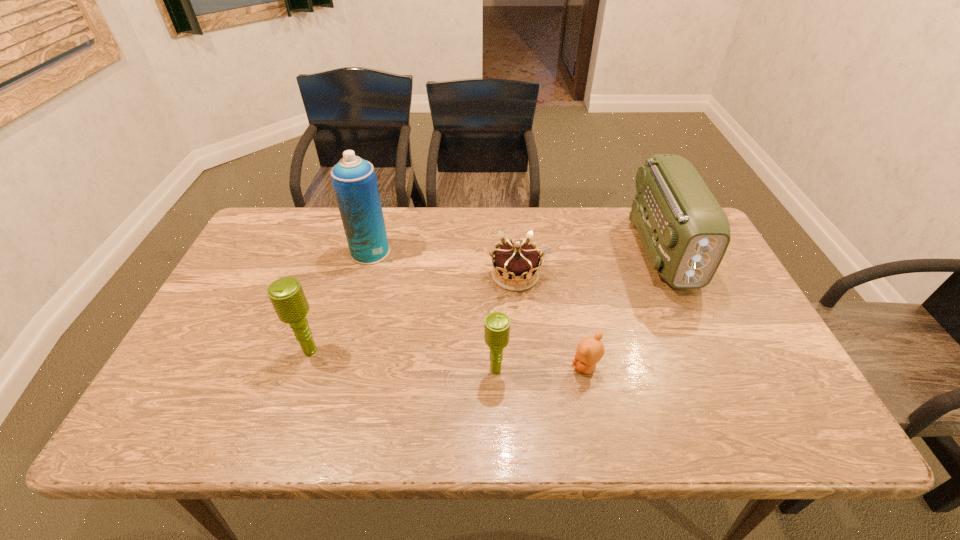
Locate an element on the screen. Image resolution: width=960 pixels, height=540 pixels. free location located 0.050m on the right of the aerosol can is located at coordinates (407, 252).

The image size is (960, 540). What are the coordinates of `free space located 0.260m on the front of the crown` in the screenshot? It's located at (523, 376).

Locate an element on the screen. This screenshot has height=540, width=960. free space located on the face of the teddy bear is located at coordinates (429, 367).

This screenshot has height=540, width=960. I want to click on free space located 0.330m on the face of the teddy bear, so click(433, 367).

The image size is (960, 540). What are the coordinates of `vacant space located on the face of the teddy bear` in the screenshot? It's located at (500, 367).

Image resolution: width=960 pixels, height=540 pixels. I want to click on radio_receiver present at the far edge, so click(685, 232).

This screenshot has height=540, width=960. Identify the location of aerosol can that is at the far edge. (354, 180).

The image size is (960, 540). What are the coordinates of `microphone that is at the near edge` in the screenshot? It's located at (497, 324).

This screenshot has height=540, width=960. Find the location of `teddy bear at the near edge`. teddy bear at the near edge is located at coordinates (590, 350).

The width and height of the screenshot is (960, 540). In order to click on object present at the right edge in this screenshot , I will do pyautogui.click(x=685, y=232).